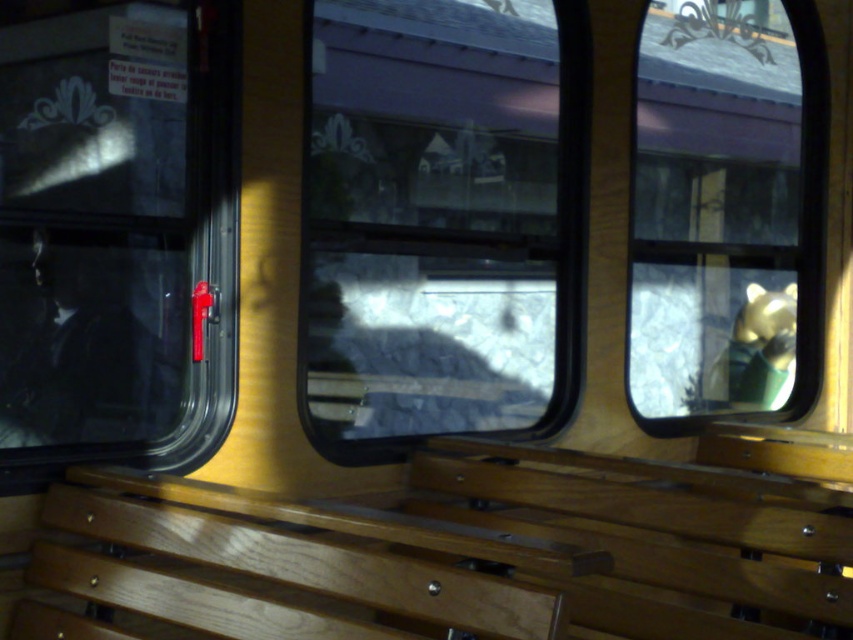
You are a passenger sitting on the wooden bench at center and want to reach the gold metallic bear at upper right. Which direction should you move to get closer to it?

The wooden bench at center is positioned under the gold metallic bear at upper right, so you should move upward to get closer to it.

You are a traveler carrying a large backpack and need to sit down. You see the wooden bench at center and the transparent glass window at left. Which one can you sit on?

The wooden bench at center is designed for sitting, while the transparent glass window at left is a window and cannot be sat on.

You are sitting on the train and looking out the window. There are two points marked on the window. The first point is at coordinate point (563, 102) and the second is at coordinate point (680, 234). Which point is closer to you?

Point (563, 102) is in front of point (680, 234), so the first point is closer to you.